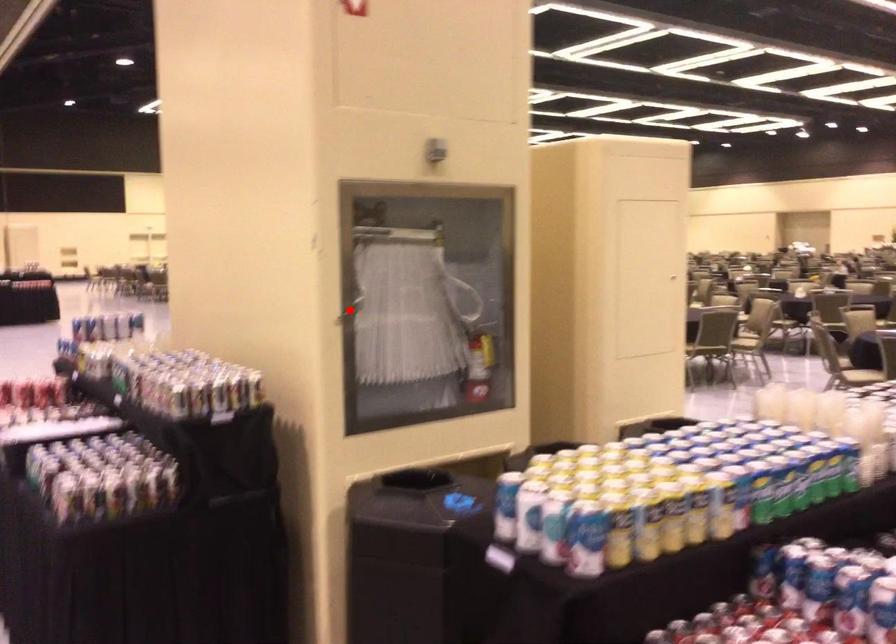
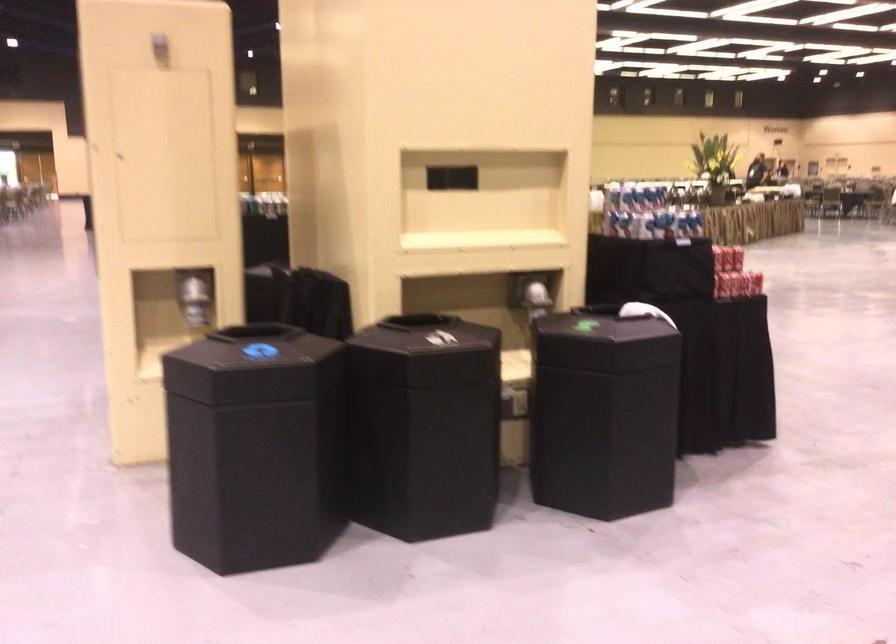
Question: I am providing you with two images of the same scene from different viewpoints. A red point is marked on the first image. At the location where the point appears in image 1, is it still visible in image 2?

Choices:
 (A) Yes
 (B) No

Answer: (B)